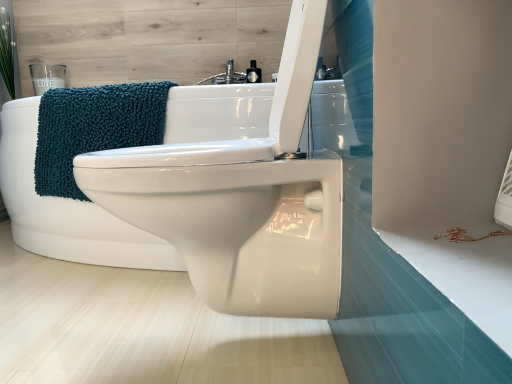
Describe the element at coordinates (94, 128) in the screenshot. I see `teal chenille bath towel at upper left` at that location.

At what (x,y) coordinates should I click in order to perform the action: click on teal chenille bath towel at upper left. Please return your answer as a coordinate pair (x, y). This screenshot has height=384, width=512. Looking at the image, I should click on (94, 128).

You are a GUI agent. You are given a task and a screenshot of the screen. Output one action in this format:
    pyautogui.click(x=<x>, y=<y>)
    Task: Click on the teal chenille bath towel at upper left
    The height and width of the screenshot is (384, 512).
    Given the screenshot: What is the action you would take?
    pyautogui.click(x=94, y=128)